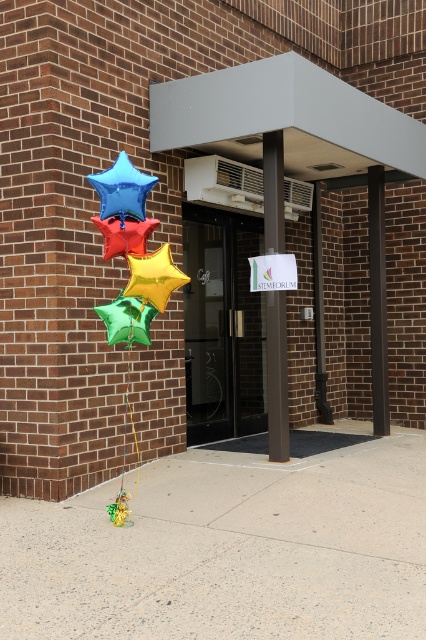
Based on the photo, does blue metallic star at upper left have a lesser width compared to metallic gold star at center?

No.

Does blue metallic star at upper left appear under metallic gold star at center?

Incorrect, blue metallic star at upper left is not positioned below metallic gold star at center.

The image size is (426, 640). Describe the element at coordinates (121, 189) in the screenshot. I see `blue metallic star at upper left` at that location.

Where is `blue metallic star at upper left`? The height and width of the screenshot is (640, 426). blue metallic star at upper left is located at coordinates (121, 189).

Is metallic gold star at center bigger than rubberized red star at center?

Correct, metallic gold star at center is larger in size than rubberized red star at center.

Between point (158, 253) and point (143, 237), which one is positioned in front?

Point (158, 253) is in front.

Is point (164, 269) farther from camera compared to point (150, 218)?

That is False.

Locate an element on the screen. The image size is (426, 640). metallic gold star at center is located at coordinates (154, 276).

In the scene shown: Is transparent glass door at center to the right of brown polished pillar at center from the viewer's perspective?

Incorrect, transparent glass door at center is not on the right side of brown polished pillar at center.

The width and height of the screenshot is (426, 640). What do you see at coordinates (222, 324) in the screenshot?
I see `transparent glass door at center` at bounding box center [222, 324].

In order to click on transparent glass door at center in this screenshot , I will do `click(222, 324)`.